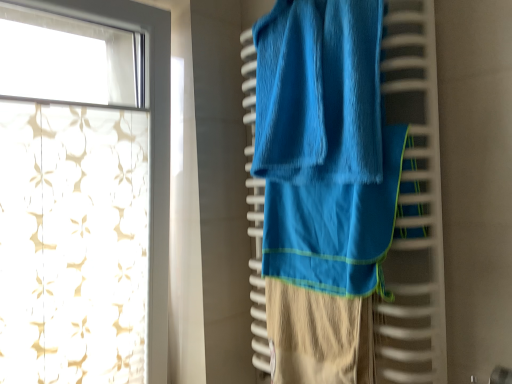
Question: From a real-world perspective, is white sheer curtain at upper left physically located above or below blue soft towel at center?

Choices:
 (A) above
 (B) below

Answer: (A)

Question: Is white sheer curtain at upper left inside or outside of blue soft towel at center?

Choices:
 (A) inside
 (B) outside

Answer: (B)

Question: Is white sheer curtain at upper left in front of or behind blue soft towel at center in the image?

Choices:
 (A) behind
 (B) front

Answer: (A)

Question: Based on their sizes in the image, would you say blue soft towel at center is bigger or smaller than white sheer curtain at upper left?

Choices:
 (A) big
 (B) small

Answer: (B)

Question: Considering the positions of blue soft towel at center and white sheer curtain at upper left in the image, is blue soft towel at center taller or shorter than white sheer curtain at upper left?

Choices:
 (A) short
 (B) tall

Answer: (A)

Question: In the image, is blue soft towel at center on the left side or the right side of white sheer curtain at upper left?

Choices:
 (A) right
 (B) left

Answer: (A)

Question: Is point (310, 29) closer or farther from the camera than point (56, 4)?

Choices:
 (A) closer
 (B) farther

Answer: (A)